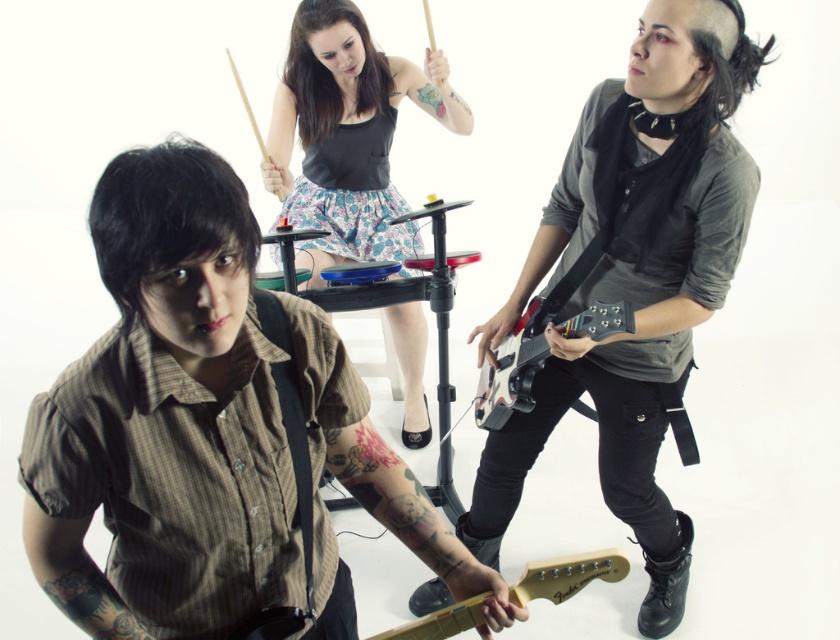
Question: Among these objects, which one is nearest to the camera?

Choices:
 (A) floral skirt at center
 (B) matte black guitar at center
 (C) shiny black electric guitar at right
 (D) brown striped shirt at center

Answer: (D)

Question: Does floral skirt at center appear on the right side of light wood electric guitar at center?

Choices:
 (A) yes
 (B) no

Answer: (B)

Question: Considering the real-world distances, which object is farthest from the matte black guitar at center?

Choices:
 (A) floral skirt at center
 (B) brown striped shirt at center
 (C) light wood electric guitar at center
 (D) shiny black electric guitar at right

Answer: (A)

Question: Does floral skirt at center have a greater width compared to shiny black electric guitar at right?

Choices:
 (A) yes
 (B) no

Answer: (A)

Question: Estimate the real-world distances between objects in this image. Which object is farther from the brown striped shirt at center?

Choices:
 (A) shiny black electric guitar at right
 (B) light wood electric guitar at center
 (C) matte black guitar at center
 (D) floral skirt at center

Answer: (D)

Question: Can you confirm if brown striped shirt at center is positioned above floral skirt at center?

Choices:
 (A) yes
 (B) no

Answer: (B)